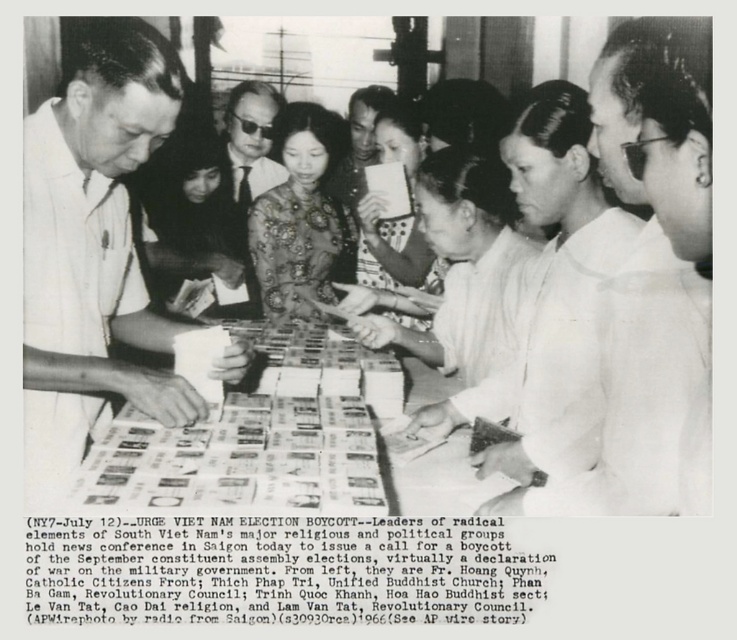
Does point (666, 308) come closer to viewer compared to point (256, 193)?

Yes, point (666, 308) is closer to viewer.

Can you confirm if white cloth shirt at right is taller than matte black suit at center?

No.

Does point (670, 157) lie in front of point (234, 180)?

Yes.

Locate an element on the screen. Image resolution: width=737 pixels, height=640 pixels. white cloth shirt at right is located at coordinates (643, 300).

Between point (680, 108) and point (132, 419), which one is positioned in front?

Positioned in front is point (680, 108).

Is white cloth shirt at right positioned before white paper at center?

Yes, it is in front of white paper at center.

Who is more distant from viewer, (506, 465) or (461, 445)?

The point (461, 445) is more distant.

Locate an element on the screen. white cloth shirt at right is located at coordinates (643, 300).

Does point (555, 481) come farther from viewer compared to point (74, 224)?

No, (555, 481) is closer to viewer.

Is point (638, 116) behind point (80, 460)?

No.

In order to click on white cloth shirt at right in this screenshot , I will do coord(643,300).